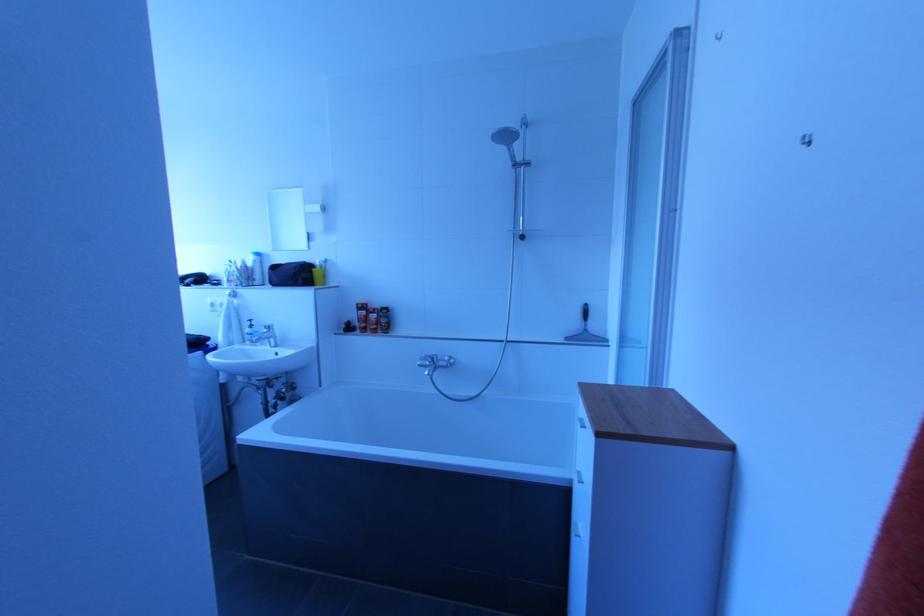
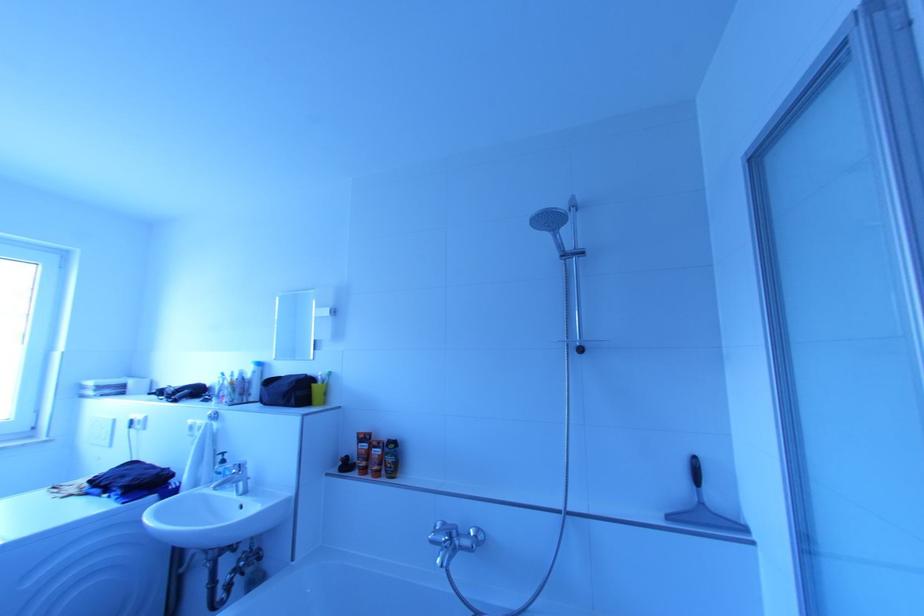
Question: How did the camera likely rotate?

Choices:
 (A) Left
 (B) Right
 (C) Up
 (D) Down

Answer: (C)